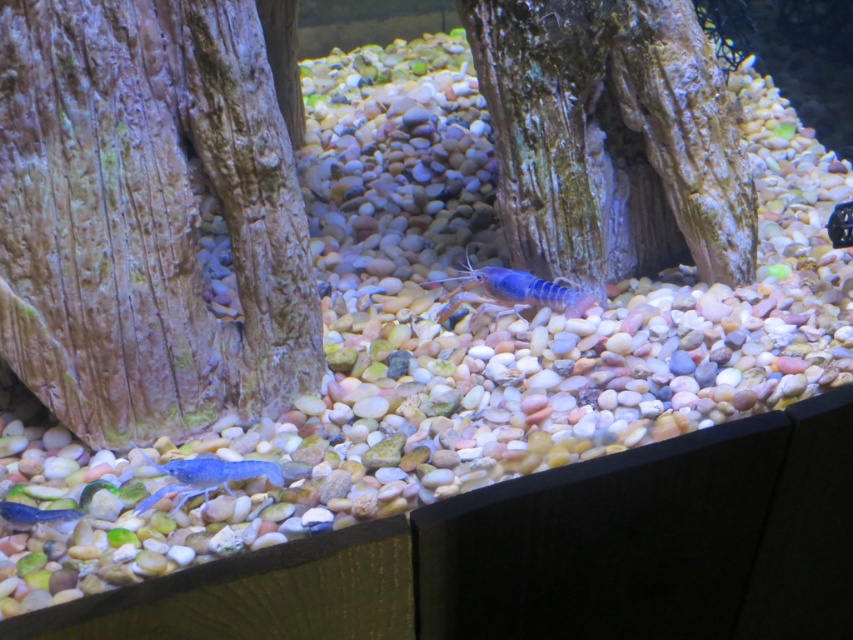
Can you confirm if wooden tree trunk at center is wider than blue matte shrimp at lower left?

Yes, wooden tree trunk at center is wider than blue matte shrimp at lower left.

Does wooden tree trunk at center have a lesser width compared to blue matte shrimp at lower left?

In fact, wooden tree trunk at center might be wider than blue matte shrimp at lower left.

Describe the element at coordinates (148, 216) in the screenshot. I see `wooden tree trunk at center` at that location.

The image size is (853, 640). I want to click on wooden tree trunk at center, so click(x=148, y=216).

Identify the location of blue matte crayfish at center. (509, 292).

Which is above, blue matte crayfish at center or matte blue shrimp at lower left?

blue matte crayfish at center is higher up.

Does point (541, 284) come in front of point (18, 509)?

No, it is behind (18, 509).

At what (x,y) coordinates should I click in order to perform the action: click on blue matte crayfish at center. Please return your answer as a coordinate pair (x, y). Looking at the image, I should click on (509, 292).

Does wooden tree trunk at center appear under rough bark tree at center?

Correct, wooden tree trunk at center is located below rough bark tree at center.

Does wooden tree trunk at center have a lesser width compared to rough bark tree at center?

Yes, wooden tree trunk at center is thinner than rough bark tree at center.

What do you see at coordinates (148, 216) in the screenshot? I see `wooden tree trunk at center` at bounding box center [148, 216].

Locate an element on the screen. This screenshot has height=640, width=853. wooden tree trunk at center is located at coordinates (148, 216).